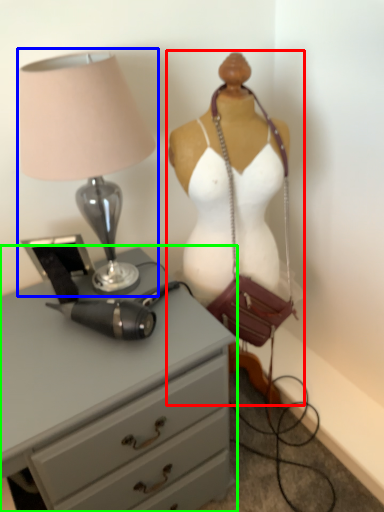
Question: Estimate the real-world distances between objects in this image. Which object is farther from mannequin (highlighted by a red box), lamp (highlighted by a blue box) or chest of drawers (highlighted by a green box)?

Choices:
 (A) lamp
 (B) chest of drawers

Answer: (B)